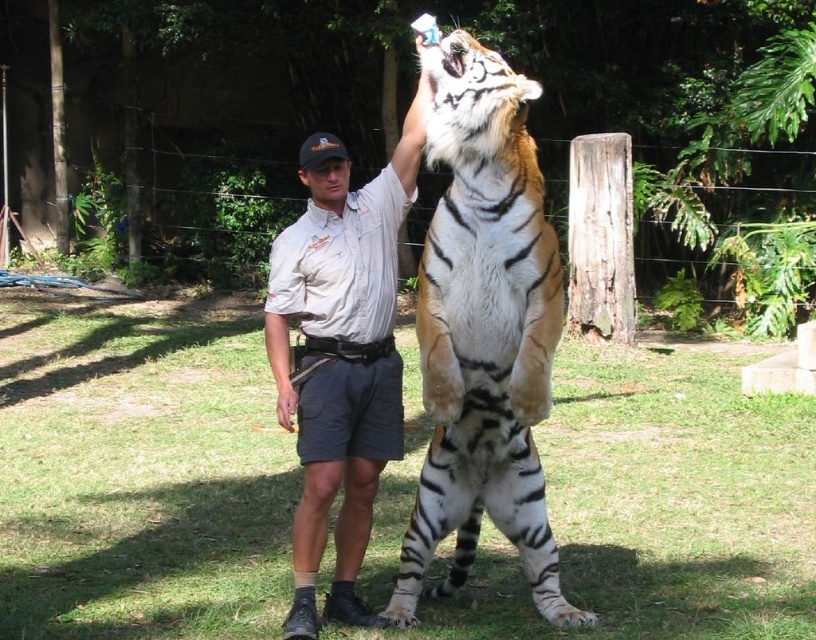
Question: Considering the relative positions of white and black striped tiger at center and white cotton shirt at center in the image provided, where is white and black striped tiger at center located with respect to white cotton shirt at center?

Choices:
 (A) below
 (B) above

Answer: (A)

Question: Which of the following is the farthest from the observer?

Choices:
 (A) white cotton shirt at center
 (B) white and black striped tiger at center

Answer: (A)

Question: Does white and black striped tiger at center appear over white cotton shirt at center?

Choices:
 (A) no
 (B) yes

Answer: (A)

Question: Is white and black striped tiger at center above white cotton shirt at center?

Choices:
 (A) yes
 (B) no

Answer: (B)